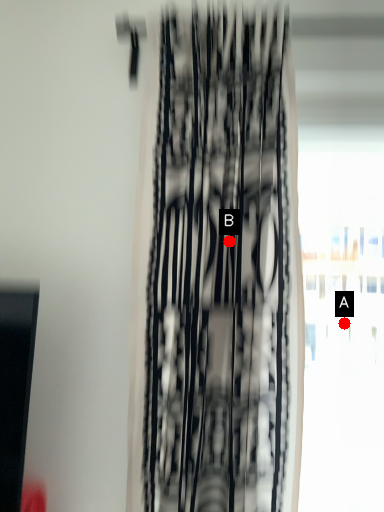
Question: Two points are circled on the image, labeled by A and B beside each circle. Among these points, which one is nearest to the camera?

Choices:
 (A) A is closer
 (B) B is closer

Answer: (B)